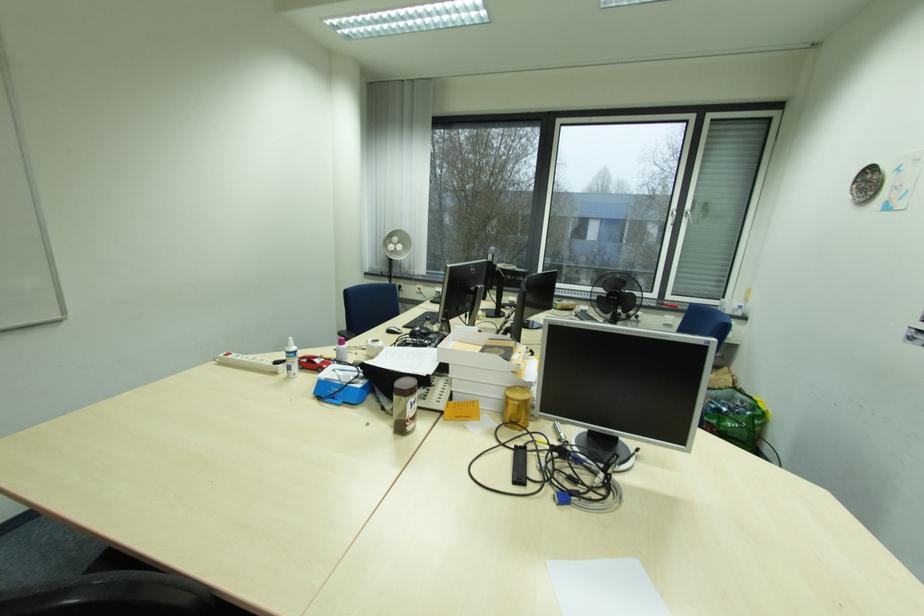
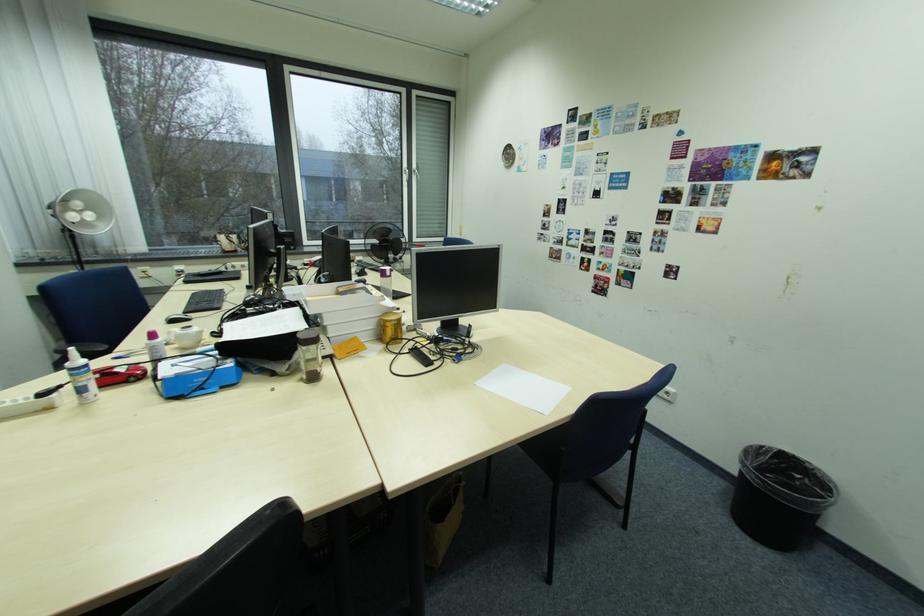
Where in the second image is the point corresponding to [295,357] from the first image?

(80, 376)